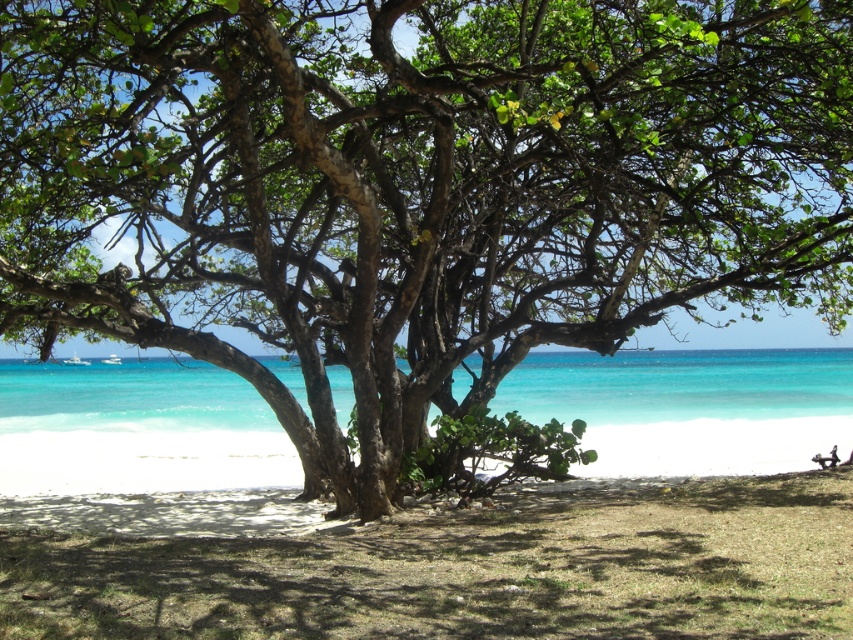
Question: Is the position of brown sand at center less distant than that of turquoise water at center?

Choices:
 (A) no
 (B) yes

Answer: (B)

Question: Which object appears closest to the camera in this image?

Choices:
 (A) brown sand at center
 (B) turquoise water at center

Answer: (A)

Question: Does brown sand at center appear under turquoise water at center?

Choices:
 (A) yes
 (B) no

Answer: (A)

Question: Is brown sand at center to the right of turquoise water at center from the viewer's perspective?

Choices:
 (A) no
 (B) yes

Answer: (B)

Question: Among these points, which one is farthest from the camera?

Choices:
 (A) (26, 625)
 (B) (759, 429)

Answer: (B)